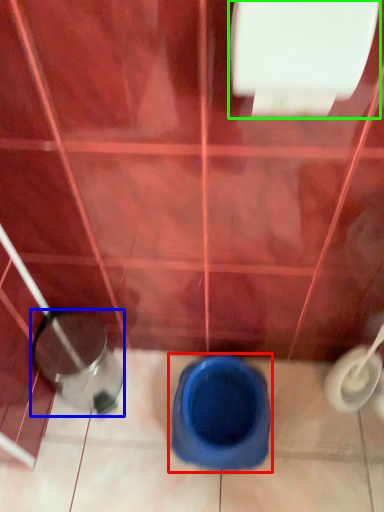
Question: Estimate the real-world distances between objects in this image. Which object is farther from toilet (highlighted by a red box), potty (highlighted by a blue box) or toilet paper (highlighted by a green box)?

Choices:
 (A) potty
 (B) toilet paper

Answer: (B)